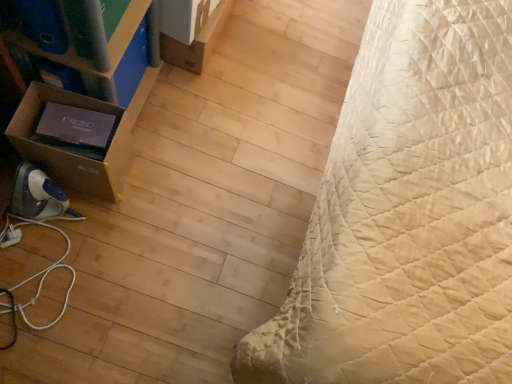
Where is `vacant space behind brown cardboard box at left, which appears as the 1th cardboard box when viewed from the left`? This screenshot has height=384, width=512. vacant space behind brown cardboard box at left, which appears as the 1th cardboard box when viewed from the left is located at coordinates (157, 125).